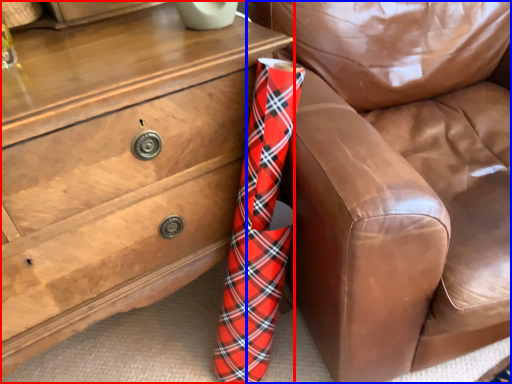
Question: Which of the following is the farthest to the observer, chest of drawers (highlighted by a red box) or furniture (highlighted by a blue box)?

Choices:
 (A) chest of drawers
 (B) furniture

Answer: (A)